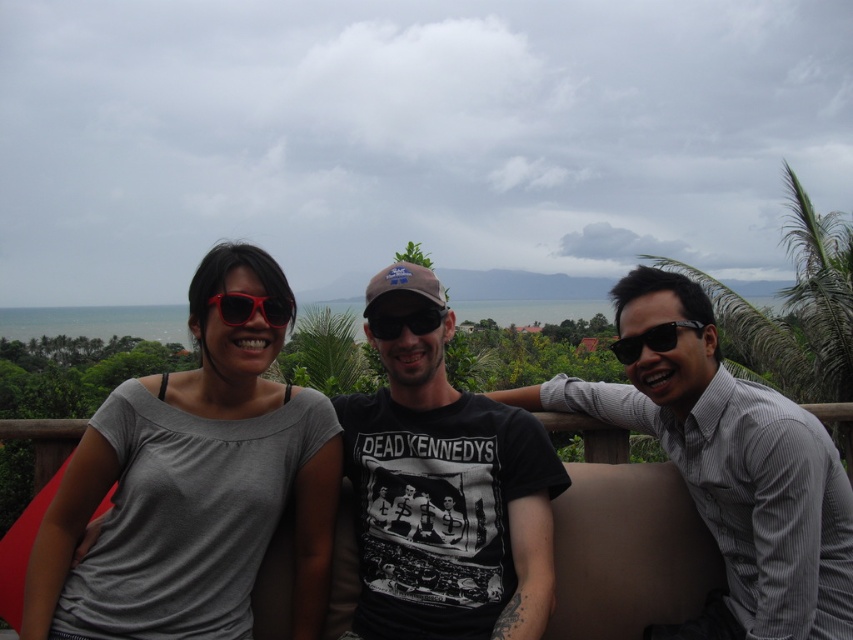
Who is more distant from viewer, (x=207, y=301) or (x=430, y=312)?

The point (x=430, y=312) is behind.

Measure the distance from matte black sunglasses at left to black matte sunglasses at center.

A distance of 23.16 inches exists between matte black sunglasses at left and black matte sunglasses at center.

Image resolution: width=853 pixels, height=640 pixels. Describe the element at coordinates (251, 308) in the screenshot. I see `matte black sunglasses at left` at that location.

This screenshot has width=853, height=640. I want to click on matte black sunglasses at left, so click(251, 308).

Can you confirm if matte gray shirt at center is wider than gray matte shirt at center?

Yes.

Does matte gray shirt at center have a larger size compared to gray matte shirt at center?

Indeed, matte gray shirt at center has a larger size compared to gray matte shirt at center.

Between point (318, 616) and point (346, 614), which one is positioned behind?

The point (346, 614) is behind.

Locate an element on the screen. The width and height of the screenshot is (853, 640). matte gray shirt at center is located at coordinates [x=192, y=486].

I want to click on gray striped shirt at center, so pos(729,468).

Does gray striped shirt at center have a smaller size compared to black matte sunglasses at center?

No.

This screenshot has width=853, height=640. In order to click on gray striped shirt at center in this screenshot , I will do `click(729, 468)`.

Locate an element on the screen. The image size is (853, 640). gray striped shirt at center is located at coordinates (729, 468).